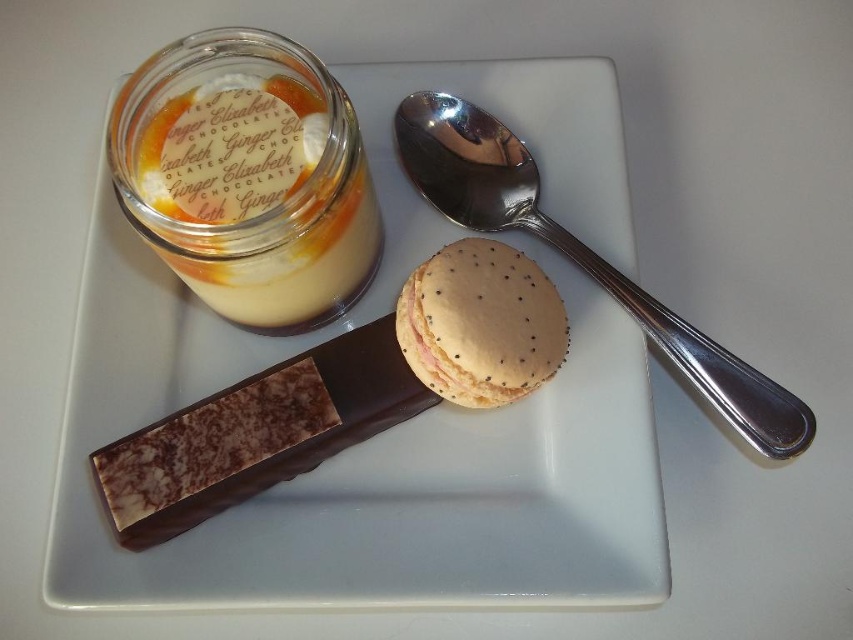
You are holding a camera and want to take a closeup photo of the macaroon at point [444,552]. The camera is currently 36.03 inches away. If the recommended distance for a closeup is 12 inches, how much closer do you need to move the camera to achieve the ideal shot?

The camera is currently 36.03 inches away from the macaroon at point [444,552]. To reach the recommended 12 inches, you need to move closer by 24.03 inches.

You are a dessert enthusiast trying to reach for the spoon to taste the dessert. You are standing at the edge of the plate. Which object is closer to you, the translucent glass jar at upper left or the silver metallic spoon at upper right?

The distance between the translucent glass jar at upper left and the silver metallic spoon at upper right is 9.74 inches. However, since you are standing at the edge of the plate, the question of which is closer depends on your position. Without knowing your exact location relative to the plate, it is impossible to determine which object is nearer.

You are a food stylist arranging a dessert display. You have a white ceramic plate at center and a golden textured macaron at center. According to the spatial arrangement, where should you place the macaron relative to the plate?

The golden textured macaron at center should be placed to the right of the white ceramic plate at center since the white ceramic plate at center is to the left of the golden textured macaron at center.